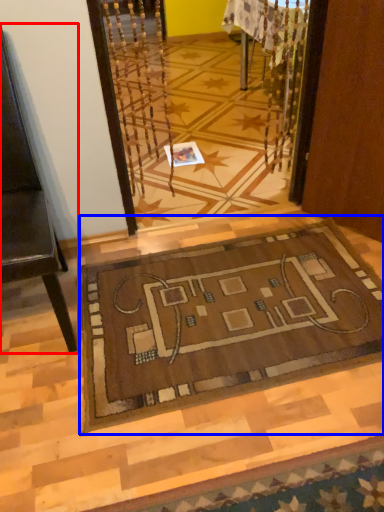
Question: Which point is closer to the camera, furniture (highlighted by a red box) or mat (highlighted by a blue box)?

Choices:
 (A) furniture
 (B) mat

Answer: (A)